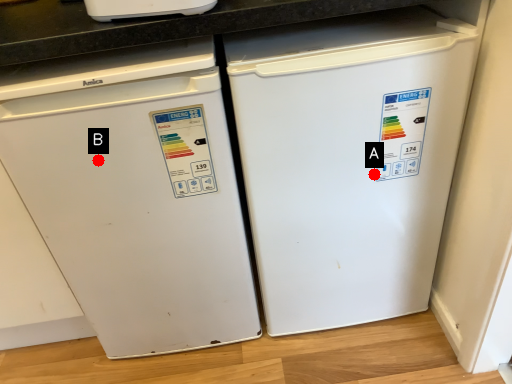
Question: Two points are circled on the image, labeled by A and B beside each circle. Which point is further to the camera?

Choices:
 (A) A is further
 (B) B is further

Answer: (A)